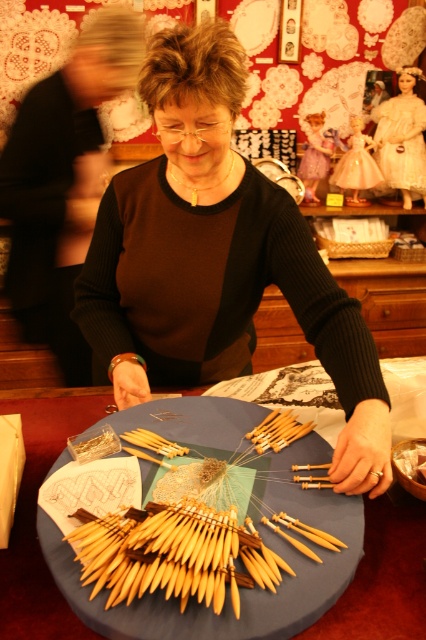
Between matte black sweater at center and white lace dress at center, which one has more height?

matte black sweater at center

Does matte black sweater at center have a smaller size compared to white lace dress at center?

Incorrect, matte black sweater at center is not smaller in size than white lace dress at center.

Does point (123, 275) come behind point (414, 134)?

No, it is not.

Identify the location of matte black sweater at center. (216, 259).

Between wooden knitting needles at center and white lace dress at center, which one has more height?

white lace dress at center is taller.

Between point (327, 499) and point (419, 145), which one is positioned behind?

Point (419, 145)

Where is `wooden knitting needles at center`? Image resolution: width=426 pixels, height=640 pixels. wooden knitting needles at center is located at coordinates (241, 589).

Is point (250, 241) behind point (172, 634)?

Yes, it is behind point (172, 634).

At what (x,y) coordinates should I click in order to perform the action: click on matte black sweater at center. Please return your answer as a coordinate pair (x, y). The width and height of the screenshot is (426, 640). Looking at the image, I should click on (216, 259).

Between point (350, 301) and point (287, 544), which one is positioned behind?

Positioned behind is point (350, 301).

Identify the location of matte black sweater at center. (216, 259).